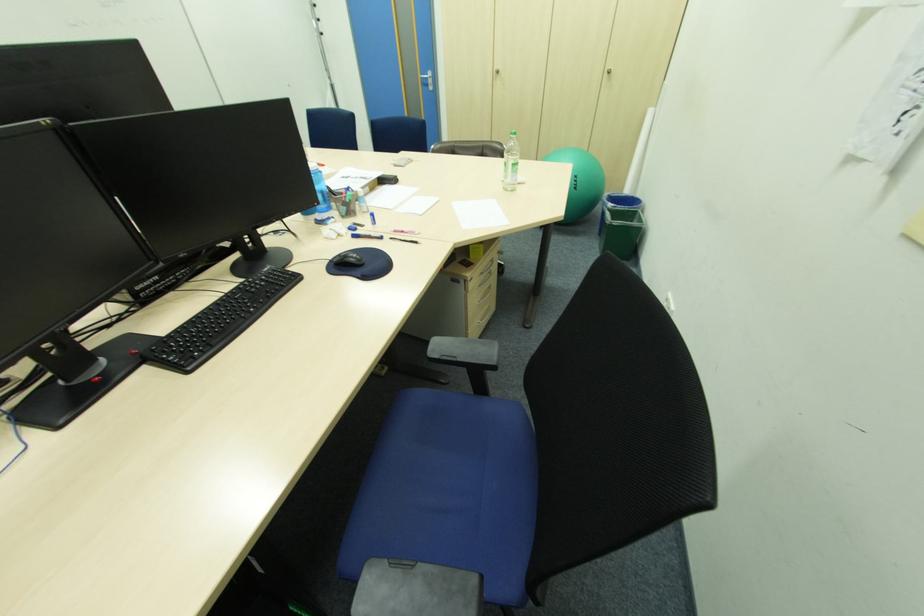
Find where to lift the blue water bottle. Please return your answer as a coordinate pair (x, y).

(319, 192)